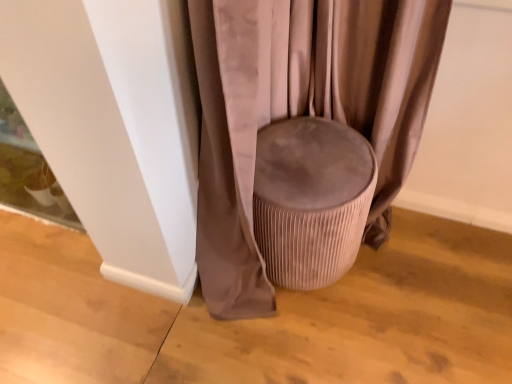
Where is `suede-like beige stool at center`? The width and height of the screenshot is (512, 384). suede-like beige stool at center is located at coordinates (301, 111).

What do you see at coordinates (301, 111) in the screenshot?
I see `suede-like beige stool at center` at bounding box center [301, 111].

You are a GUI agent. You are given a task and a screenshot of the screen. Output one action in this format:
    pyautogui.click(x=<x>, y=<y>)
    Task: Click on the suede-like beige stool at center
    
    Given the screenshot: What is the action you would take?
    pyautogui.click(x=301, y=111)